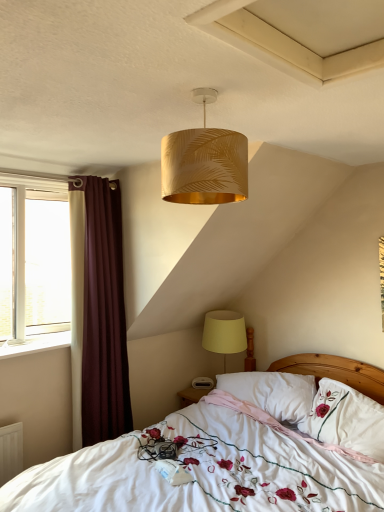
Question: Considering the relative sizes of white embroidered pillow at center, which is counted as the first pillow, starting from the right, and white embroidered bed at center in the image provided, is white embroidered pillow at center, which is counted as the first pillow, starting from the right, bigger than white embroidered bed at center?

Choices:
 (A) yes
 (B) no

Answer: (B)

Question: Is the position of white embroidered pillow at center, which ranks as the second pillow in left-to-right order, less distant than that of white embroidered bed at center?

Choices:
 (A) yes
 (B) no

Answer: (B)

Question: Is white embroidered pillow at center, which is counted as the first pillow, starting from the right, directly adjacent to white embroidered bed at center?

Choices:
 (A) no
 (B) yes

Answer: (A)

Question: From the image's perspective, is white embroidered pillow at center, which is counted as the first pillow, starting from the right, above white embroidered bed at center?

Choices:
 (A) yes
 (B) no

Answer: (A)

Question: Considering the relative sizes of white embroidered pillow at center, which is counted as the first pillow, starting from the right, and white embroidered bed at center in the image provided, is white embroidered pillow at center, which is counted as the first pillow, starting from the right, wider than white embroidered bed at center?

Choices:
 (A) no
 (B) yes

Answer: (A)

Question: Considering the relative sizes of white embroidered pillow at center, which is counted as the first pillow, starting from the right, and white embroidered bed at center in the image provided, is white embroidered pillow at center, which is counted as the first pillow, starting from the right, shorter than white embroidered bed at center?

Choices:
 (A) yes
 (B) no

Answer: (A)

Question: Is gold leaf-patterned lampshade at upper center, marked as the 2th lamp in a back-to-front arrangement, completely or partially inside burgundy fabric curtain at left?

Choices:
 (A) no
 (B) yes

Answer: (A)

Question: Is burgundy fabric curtain at left not within gold leaf-patterned lampshade at upper center, which is counted as the second lamp, starting from the bottom?

Choices:
 (A) no
 (B) yes

Answer: (B)

Question: Does burgundy fabric curtain at left have a smaller size compared to gold leaf-patterned lampshade at upper center, which is counted as the second lamp, starting from the bottom?

Choices:
 (A) yes
 (B) no

Answer: (B)

Question: Considering the relative sizes of burgundy fabric curtain at left and gold leaf-patterned lampshade at upper center, acting as the first lamp starting from the top, in the image provided, is burgundy fabric curtain at left shorter than gold leaf-patterned lampshade at upper center, acting as the first lamp starting from the top,?

Choices:
 (A) yes
 (B) no

Answer: (B)

Question: Is burgundy fabric curtain at left at the left side of gold leaf-patterned lampshade at upper center, which is counted as the second lamp, starting from the bottom?

Choices:
 (A) yes
 (B) no

Answer: (A)

Question: Is burgundy fabric curtain at left thinner than gold leaf-patterned lampshade at upper center, acting as the first lamp starting from the top?

Choices:
 (A) no
 (B) yes

Answer: (A)

Question: From the image's perspective, is white soft pillow at center, which is the first pillow from left to right, located above gold leaf-patterned lampshade at upper center, marked as the first lamp in a front-to-back arrangement?

Choices:
 (A) yes
 (B) no

Answer: (B)